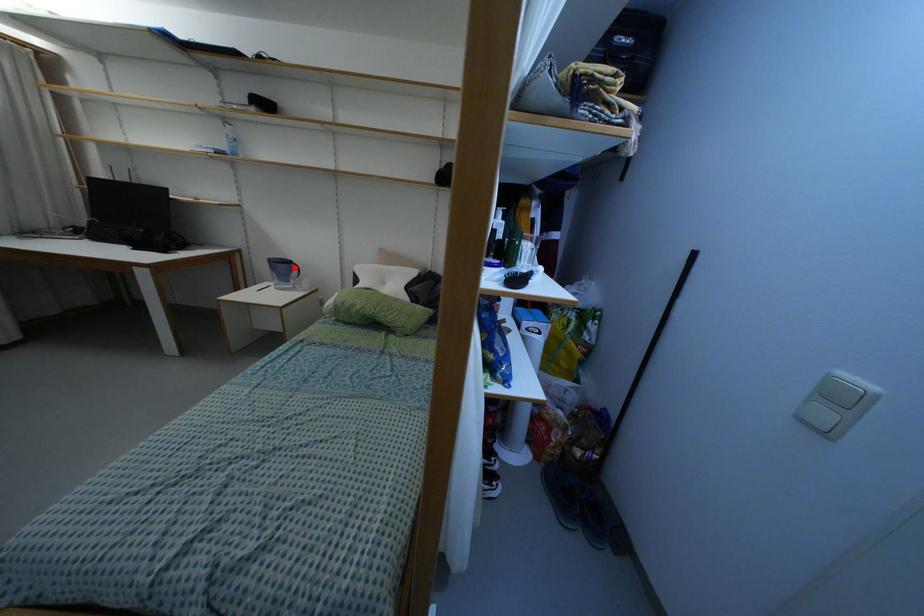
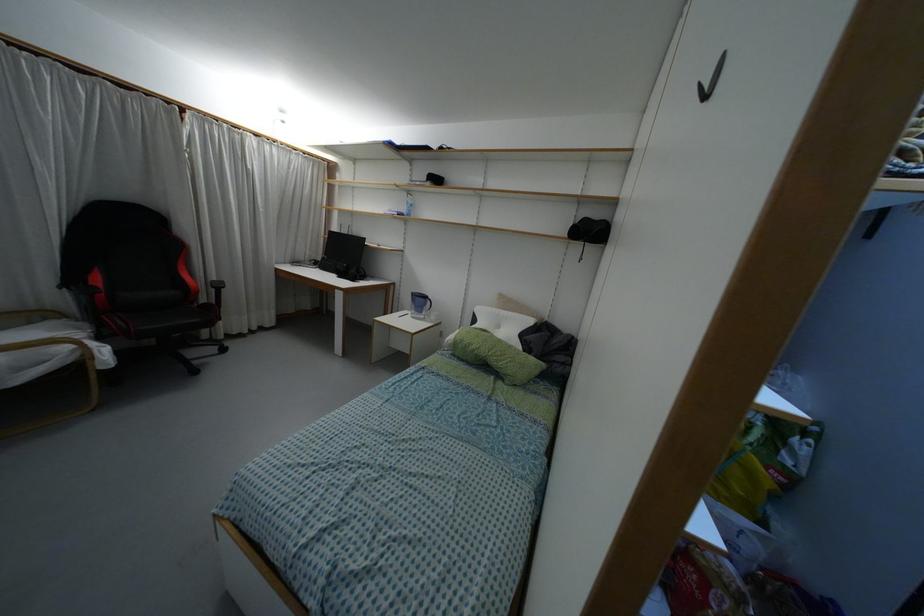
Question: I am providing you with two images of the same scene from different viewpoints. A red point is shown in image1. For the corresponding object point in image2, is it positioned nearer or farther from the camera?

Choices:
 (A) Nearer
 (B) Farther

Answer: (B)